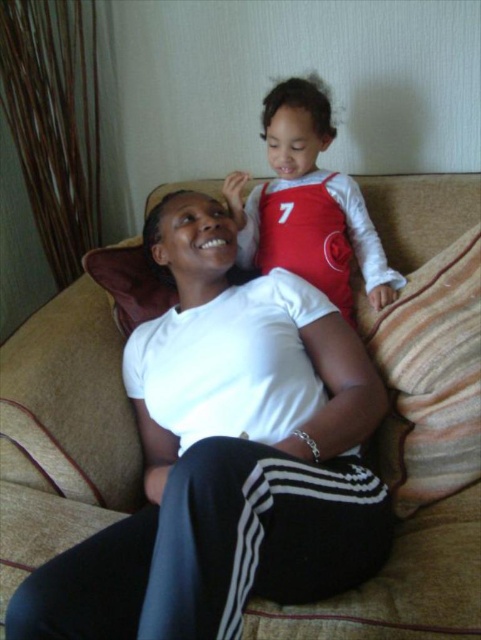
You are a photographer setting up for a family portrait. You need to position a small stool between the beige fabric couch at center and the matte red jersey at upper center to place a camera on. Based on their positions, will the stool placed between them be closer to the couch or the jersey?

The stool placed between the beige fabric couch at center and the matte red jersey at upper center will be closer to the couch because the couch is closer to the viewer than the jersey.

You are a photographer setting up for a family photo. You see the beige fabric couch at center and the matte red jersey at upper center in the scene. Which object should you position closer to the left side of your camera frame to ensure proper alignment?

You should position the matte red jersey at upper center closer to the left side of your camera frame because the beige fabric couch at center is to the right of it.